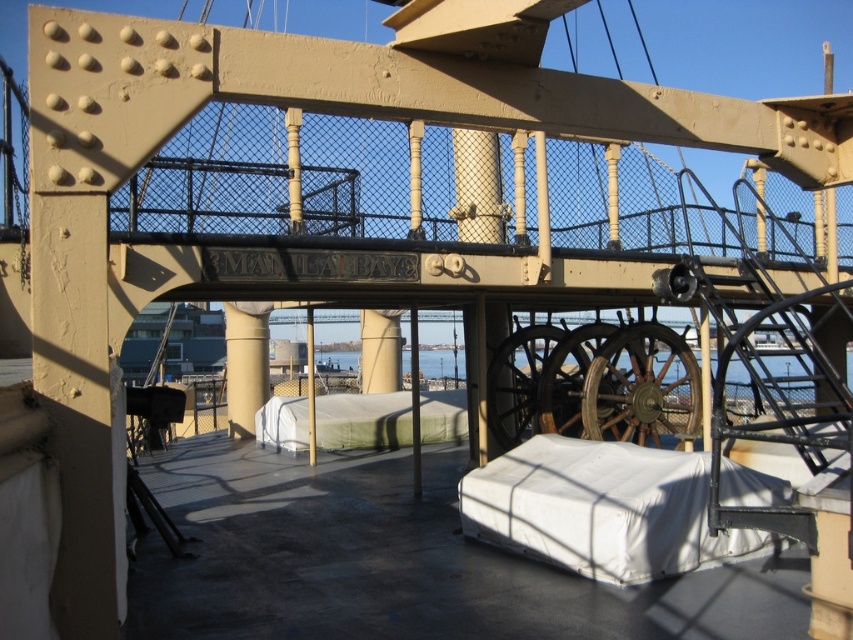
Question: Is rusty metal wheel at center wider than metallic polished wheel at center?

Choices:
 (A) no
 (B) yes

Answer: (B)

Question: Is white fabric ramp at center wider than metallic polished wheel at center?

Choices:
 (A) no
 (B) yes

Answer: (B)

Question: Which point appears closest to the camera in this image?

Choices:
 (A) (399, 428)
 (B) (596, 364)
 (C) (595, 346)
 (D) (517, 424)

Answer: (B)

Question: Which of the following is the farthest from the observer?

Choices:
 (A) (527, 524)
 (B) (502, 429)

Answer: (B)

Question: Which is nearer to the white fabric-covered ramp at center?

Choices:
 (A) metallic polished wheel at center
 (B) rustic metal ship's wheel at center
 (C) rusty metal wheel at center

Answer: (A)

Question: Can you confirm if white fabric ramp at center is positioned above metallic polished wheel at center?

Choices:
 (A) yes
 (B) no

Answer: (B)